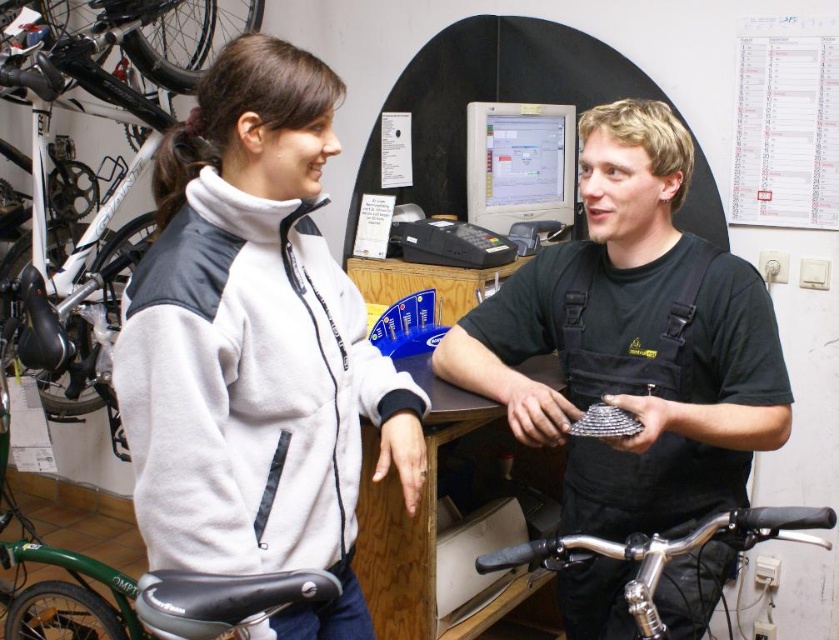
In the bicycle shop scene, there is a woman in a light gray and black jacket and a man in a dark green T shirt and a black matte uniform at center represented by point [634,340]. Which person is wearing the black matte uniform at center?

The man in the dark green T shirt and black matte uniform at center is wearing the black matte uniform at center as he is holding a small circular object, possibly a bicycle part, and the black matte uniform at center is represented by point [634,340].

You are a customer in the bike shop and need to place a small item on a surface. The matte gray monitor at center and the polished chrome handlebars at lower center are both available. Which surface is closer to you?

The polished chrome handlebars at lower center are closer to you since they are only 3.88 feet away from the matte gray monitor at center, but since the question is about which is closer to you, and the handlebars are at lower center while the monitor is at center, the exact distance from you isn

You are a customer in a bike shop and see the black matte uniform at center. If you want to hand the shopkeeper a tool that is 1.5 meters long, can you reach them without moving closer?

The black matte uniform at center is 1.29 meters away from viewer. Since the tool is 1.5 meters long, you can extend it to reach the shopkeeper.